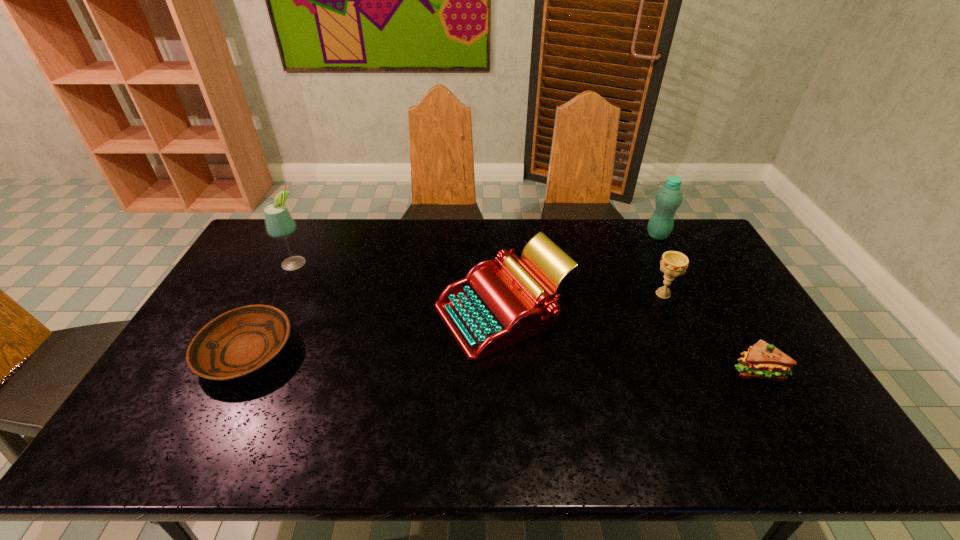
This screenshot has height=540, width=960. What are the coordinates of `water bottle located in the far edge section of the desktop` in the screenshot? It's located at (668, 199).

The width and height of the screenshot is (960, 540). I want to click on alcohol present at the left edge, so click(279, 223).

This screenshot has width=960, height=540. I want to click on plate that is at the left edge, so click(237, 343).

Where is `water bottle at the right edge`? water bottle at the right edge is located at coordinates (668, 199).

Identify the location of sandwich present at the right edge. (762, 360).

This screenshot has width=960, height=540. Find the location of `object located at the far left corner`. object located at the far left corner is located at coordinates (279, 223).

You are a GUI agent. You are given a task and a screenshot of the screen. Output one action in this format:
    pyautogui.click(x=<x>, y=<y>)
    Task: Click on the object situated at the far right corner
    
    Given the screenshot: What is the action you would take?
    pyautogui.click(x=668, y=199)

This screenshot has width=960, height=540. In the image, there is a desktop. In order to click on free space at the far edge in this screenshot , I will do `click(322, 219)`.

Identify the location of free space at the near edge of the desktop. The height and width of the screenshot is (540, 960). (514, 443).

This screenshot has height=540, width=960. Identify the location of free region at the left edge. (162, 403).